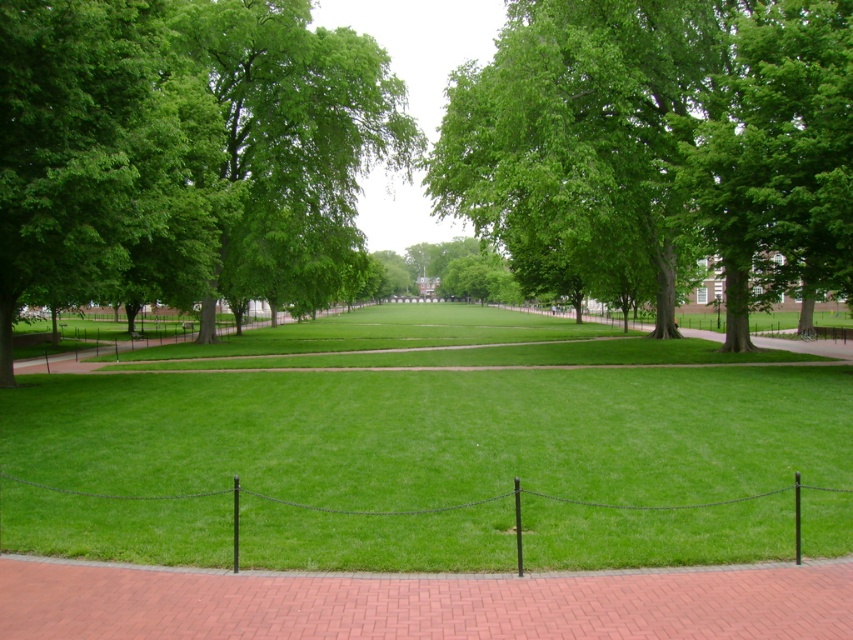
Based on the photo, you are a gardener planning to mow the green grass at center and trim the green leafy tree at center. Which task requires more time considering their sizes?

The green grass at center is wider than the green leafy tree at center, so mowing the green grass at center will take more time.

You are walking along the brick path at center in the park and want to reach the green leafy tree at center. Which direction should you walk to get closer to the tree?

To reach the green leafy tree at center from the brick path at center, you should walk to the right since the green leafy tree at center is positioned on the right side of the brick path at center.